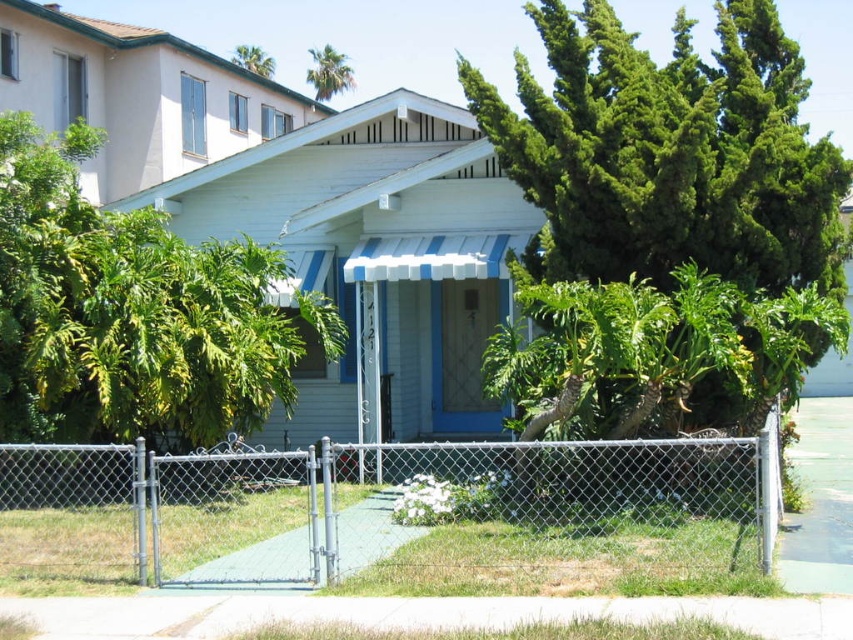
Measure the distance between point (335, 86) and camera.

They are 114.51 feet apart.

Between point (320, 72) and point (267, 61), which one is positioned behind?

Positioned behind is point (320, 72).

Is point (329, 61) in front of point (252, 60)?

No, it is not.

The image size is (853, 640). Identify the location of green leafy palm tree at upper center. (328, 72).

Which of these two, metallic silver fence at lower left or green leafy palm tree at upper center, stands shorter?

With less height is metallic silver fence at lower left.

In the scene shown: Is metallic silver fence at lower left above green leafy palm tree at upper center?

No, metallic silver fence at lower left is not above green leafy palm tree at upper center.

Locate an element on the screen. The width and height of the screenshot is (853, 640). metallic silver fence at lower left is located at coordinates pyautogui.click(x=372, y=509).

I want to click on metallic silver fence at lower left, so click(x=372, y=509).

Does point (28, 532) lie behind point (242, 60)?

No, it is in front of (242, 60).

Which of these two, metallic silver fence at lower left or green leafy tree at upper center, stands shorter?

Standing shorter between the two is metallic silver fence at lower left.

Identify the location of metallic silver fence at lower left. (372, 509).